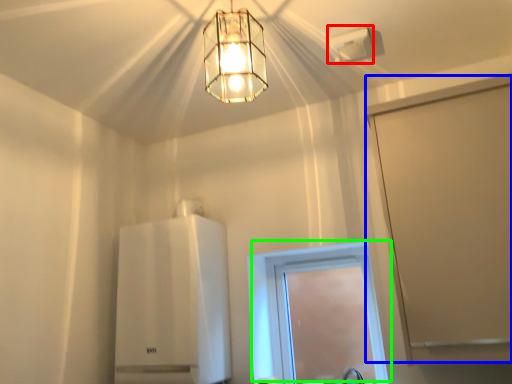
Question: Which object is the closest to the lamp (highlighted by a red box)? Choose among these: screen door (highlighted by a blue box) or window (highlighted by a green box).

Choices:
 (A) screen door
 (B) window

Answer: (A)